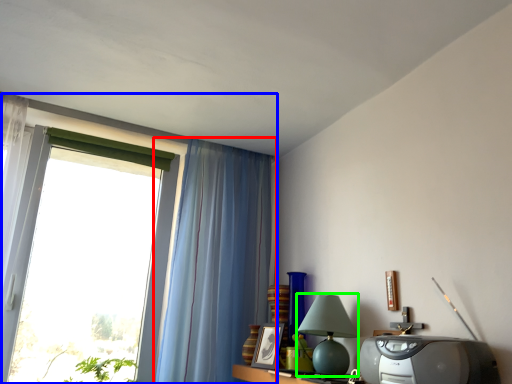
Question: Based on their relative distances, which object is farther from curtain (highlighted by a red box)? Choose from window (highlighted by a blue box) and table lamp (highlighted by a green box).

Choices:
 (A) window
 (B) table lamp

Answer: (B)